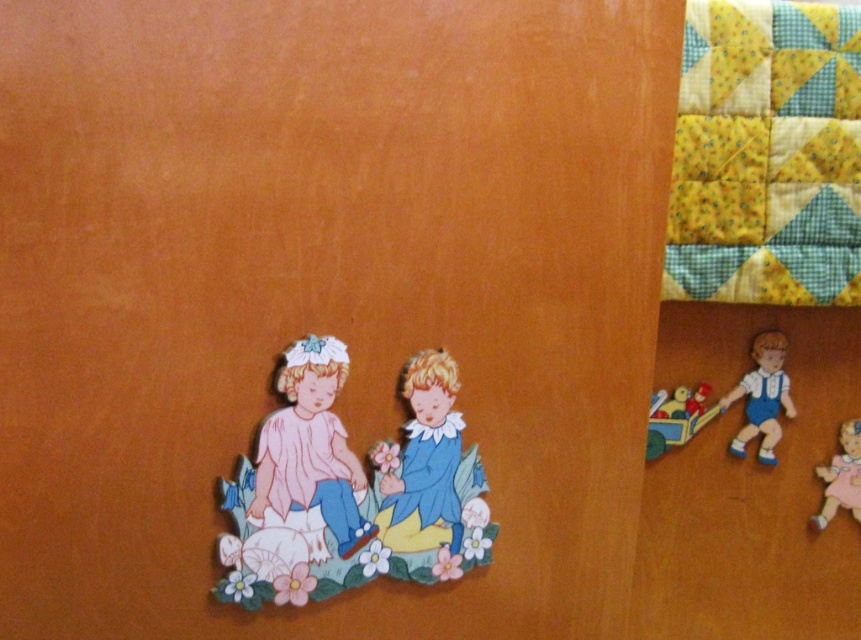
Is yellow-green patchwork quilt at upper right further to camera compared to matte plastic toy train at lower right?

That is False.

Does yellow-green patchwork quilt at upper right have a lesser width compared to matte plastic toy train at lower right?

In fact, yellow-green patchwork quilt at upper right might be wider than matte plastic toy train at lower right.

Identify the location of yellow-green patchwork quilt at upper right. (766, 156).

Between yellow-green patchwork quilt at upper right and matte wooden children at lower left, which one has less height?

matte wooden children at lower left

Who is taller, yellow-green patchwork quilt at upper right or matte wooden children at lower left?

With more height is yellow-green patchwork quilt at upper right.

Find the location of a particular element. This screenshot has width=861, height=640. yellow-green patchwork quilt at upper right is located at coordinates (766, 156).

In the scene shown: Can you confirm if yellow-green patchwork quilt at upper right is positioned above matte paper child at center?

Yes.

Between point (676, 188) and point (419, 397), which one is positioned behind?

Positioned behind is point (676, 188).

Where is `yellow-green patchwork quilt at upper right`? The width and height of the screenshot is (861, 640). yellow-green patchwork quilt at upper right is located at coordinates tap(766, 156).